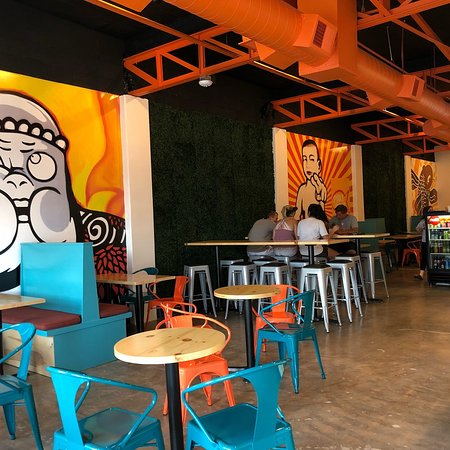
The image size is (450, 450). I want to click on art, so click(x=426, y=186), click(x=323, y=184), click(x=36, y=184).